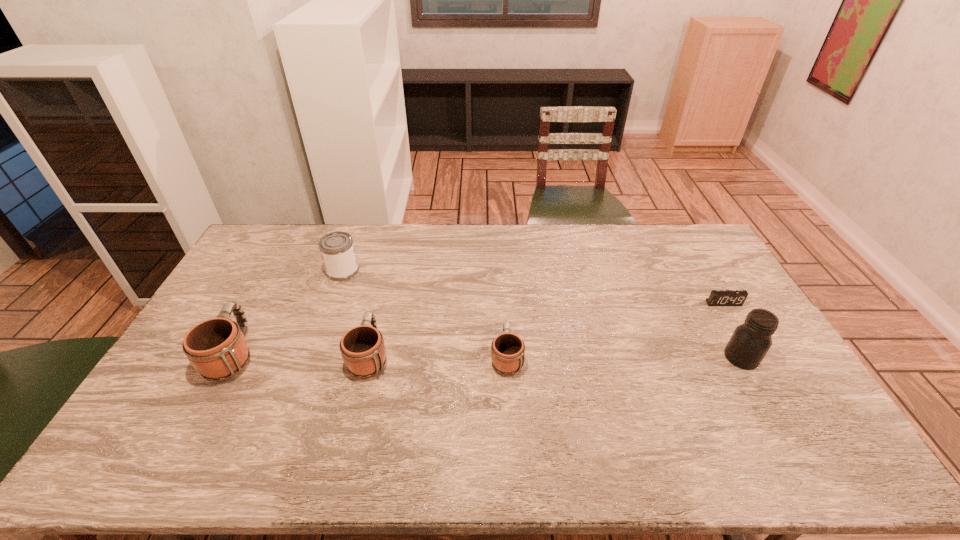
Where is `the leftmost object`? The width and height of the screenshot is (960, 540). the leftmost object is located at coordinates (216, 348).

Find the location of a particular element. Image resolution: width=960 pixels, height=540 pixels. the tallest mug is located at coordinates (216, 348).

Locate an element on the screen. This screenshot has height=540, width=960. the fourth tallest object is located at coordinates (363, 350).

Locate an element on the screen. The height and width of the screenshot is (540, 960). the second shortest mug is located at coordinates (363, 350).

Where is `the fifth tallest object`? the fifth tallest object is located at coordinates (507, 349).

The height and width of the screenshot is (540, 960). What are the coordinates of `the shortest mug` in the screenshot? It's located at (507, 349).

Identify the location of can. (337, 250).

Locate an element on the screen. The width and height of the screenshot is (960, 540). the fifth object from right to left is located at coordinates 337,250.

I want to click on alarm clock, so click(x=717, y=297).

At what (x,y) coordinates should I click in order to perform the action: click on the shortest object. Please return your answer as a coordinate pair (x, y). Looking at the image, I should click on (717, 297).